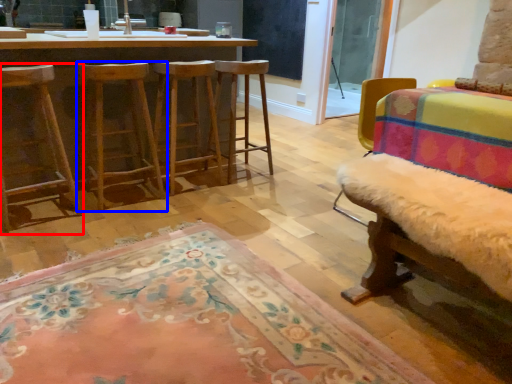
Question: Which object appears closest to the camera in this image, chair (highlighted by a red box) or stool (highlighted by a blue box)?

Choices:
 (A) chair
 (B) stool

Answer: (A)